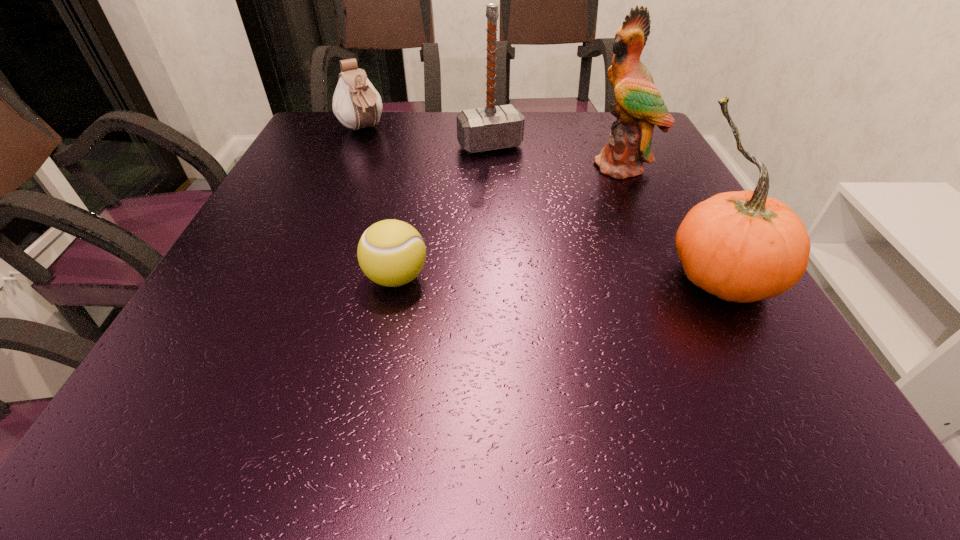
The width and height of the screenshot is (960, 540). What are the coordinates of `free space on the desktop that is between the tennis ball and the pumpkin and is positioned on the striking surface of the hammer` in the screenshot? It's located at (575, 278).

Where is `free space on the desktop that is between the second object from left to right and the pumpkin and is positioned on the front-facing side of the parrot`? free space on the desktop that is between the second object from left to right and the pumpkin and is positioned on the front-facing side of the parrot is located at coordinates (517, 278).

You are a GUI agent. You are given a task and a screenshot of the screen. Output one action in this format:
    pyautogui.click(x=<x>, y=<y>)
    Task: Click on the vacant spot on the desktop that is between the tennis ball and the pumpkin and is positioned on the front-facing side of the leftmost object
    This screenshot has height=540, width=960.
    Given the screenshot: What is the action you would take?
    516,278